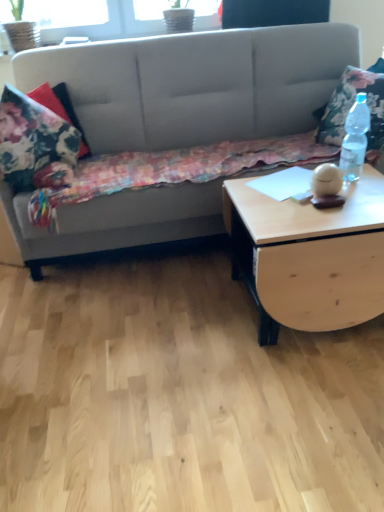
Find the location of `free space in front of light wood/texture coffee table at right`. free space in front of light wood/texture coffee table at right is located at coordinates (304, 399).